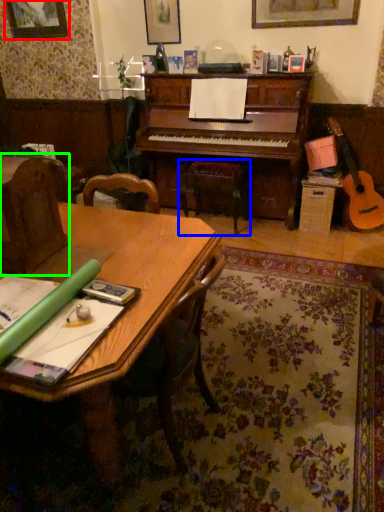
Question: Which object is the closest to the picture frame (highlighted by a red box)? Choose among these: music stool (highlighted by a blue box) or armchair (highlighted by a green box).

Choices:
 (A) music stool
 (B) armchair

Answer: (A)